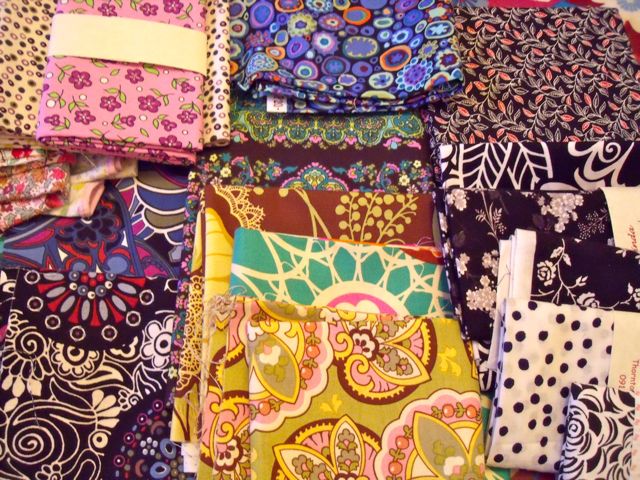
Locate an element on the screen. variety of printed fabrics folded is located at coordinates (364, 293).